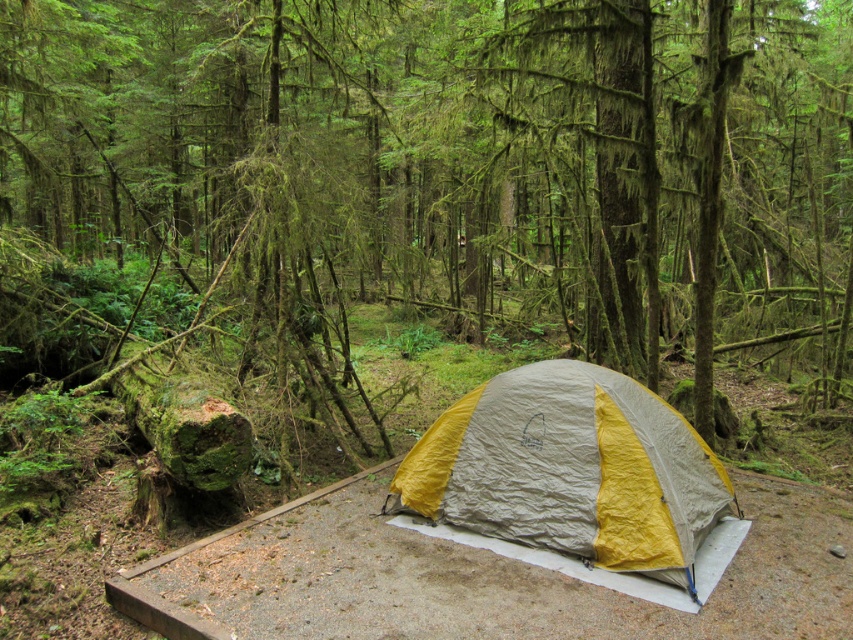
Is green mossy tree at center below yellow fabric tent at center?

Incorrect, green mossy tree at center is not positioned below yellow fabric tent at center.

Does green mossy tree at center appear on the right side of yellow fabric tent at center?

In fact, green mossy tree at center is to the left of yellow fabric tent at center.

Which is in front, point (495, 257) or point (691, 577)?

Point (691, 577) is in front.

The image size is (853, 640). In order to click on green mossy tree at center in this screenshot , I will do (x=456, y=161).